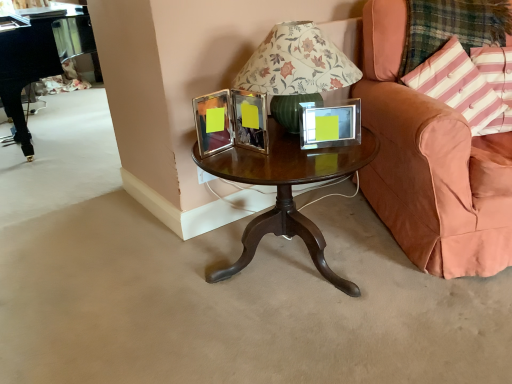
Where is `vacant space in front of mahogany wood coffee table at center`? This screenshot has height=384, width=512. vacant space in front of mahogany wood coffee table at center is located at coordinates (313, 347).